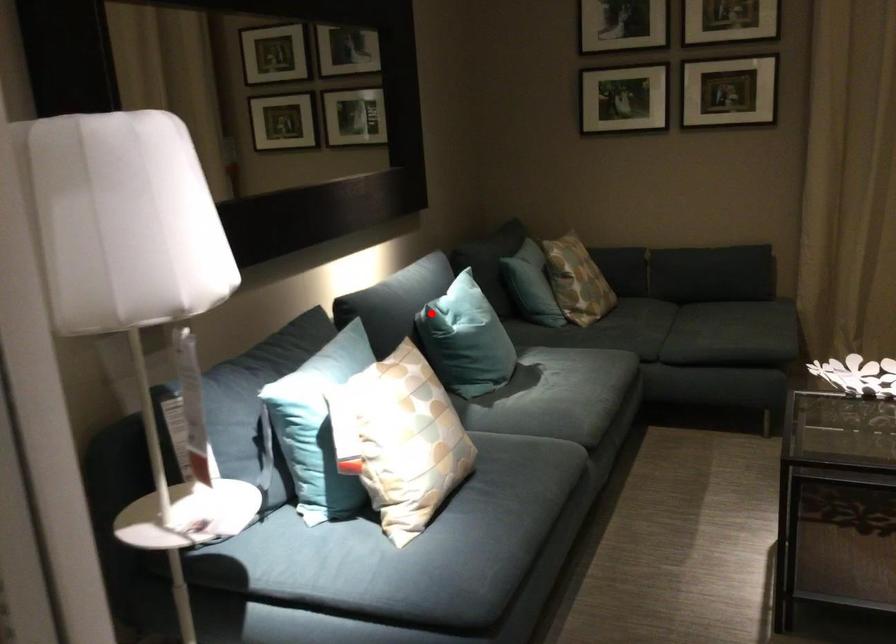
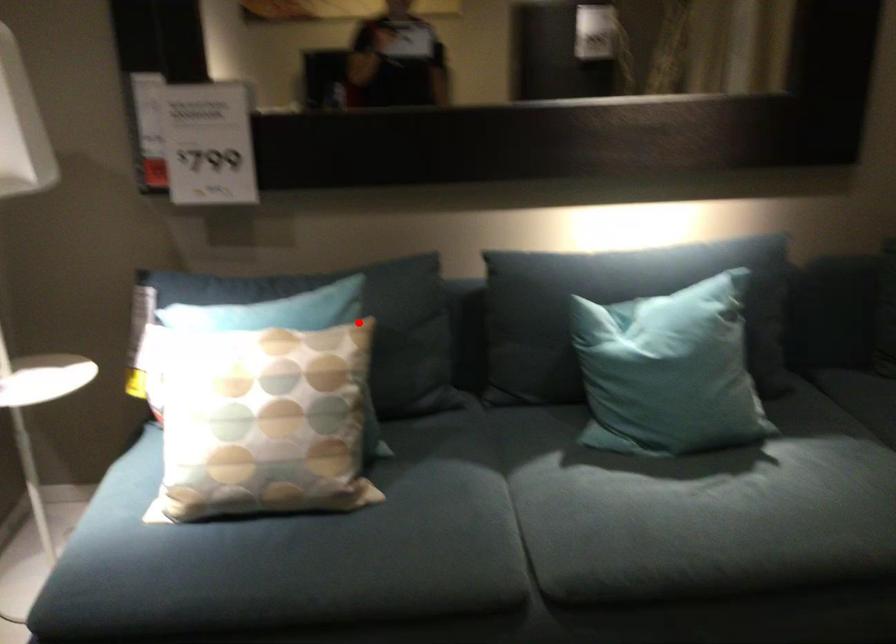
I am providing you with two images of the same scene from different viewpoints. A red point is marked on the first image and another point is marked on the second image. Does the point marked in image1 correspond to the same location as the one in image2?

No